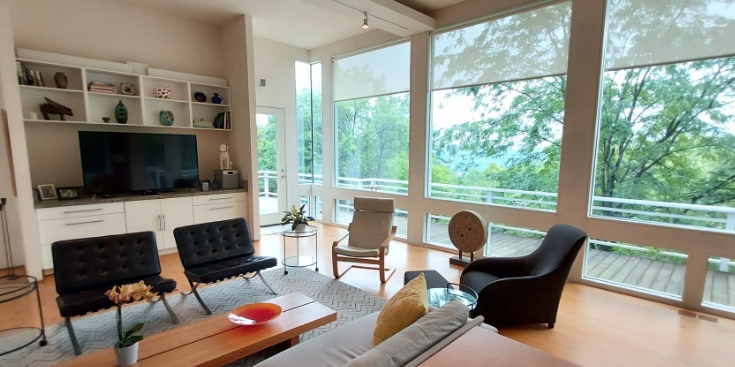
Locate an element on the screen. tv is located at coordinates (143, 164).